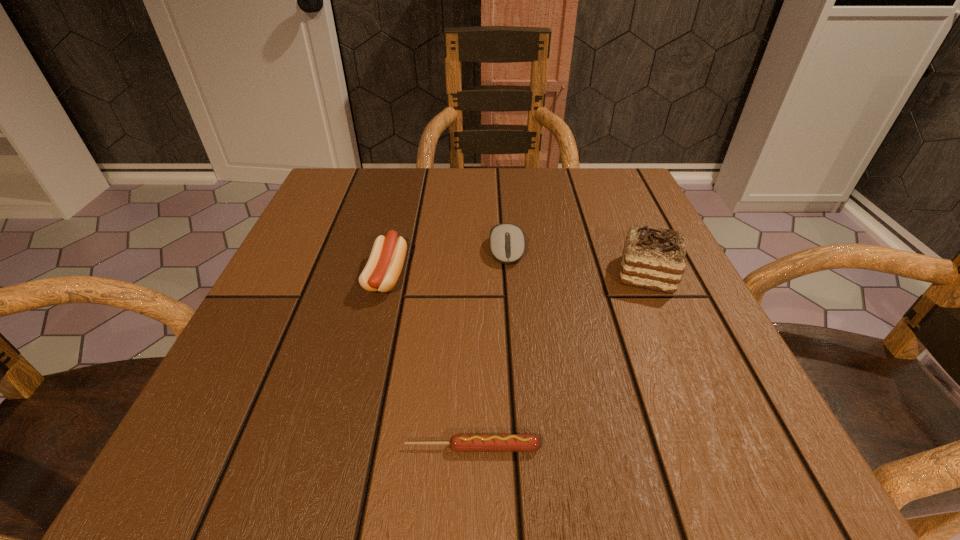
This screenshot has height=540, width=960. In order to click on chocolate cake in this screenshot , I will do `click(653, 258)`.

Find the location of a particular element. the rightmost object is located at coordinates (653, 258).

Where is `the leftmost object`? the leftmost object is located at coordinates (383, 268).

At what (x,y) coordinates should I click in order to perform the action: click on the taller sausage. Please return your answer as a coordinate pair (x, y). The height and width of the screenshot is (540, 960). Looking at the image, I should click on (383, 268).

Identify the location of the third tallest object. (507, 242).

Where is `the shorter sausage`? the shorter sausage is located at coordinates (459, 442).

At what (x,y) coordinates should I click in order to perform the action: click on the shortest object. Please return your answer as a coordinate pair (x, y). The width and height of the screenshot is (960, 540). Looking at the image, I should click on (459, 442).

Locate an element on the screen. This screenshot has height=540, width=960. blank area located on the left of the tallest object is located at coordinates (398, 275).

Identify the location of vacant region located on the right of the left sausage. This screenshot has height=540, width=960. (550, 274).

Locate an element on the screen. free space located on the wheel side of the computer equipment is located at coordinates [x=518, y=413].